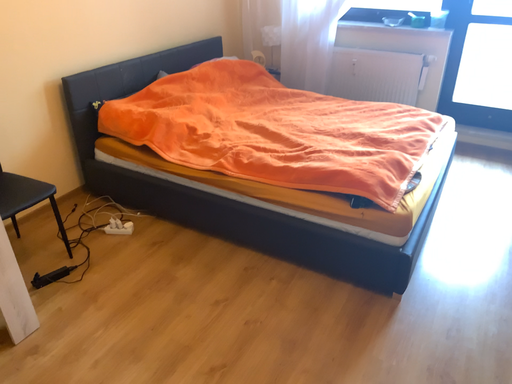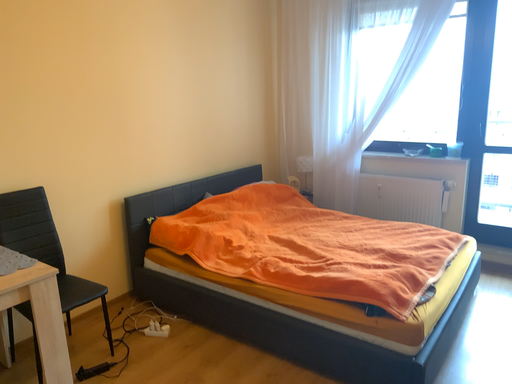
Question: Which way did the camera rotate in the video?

Choices:
 (A) rotated downward
 (B) rotated upward

Answer: (B)